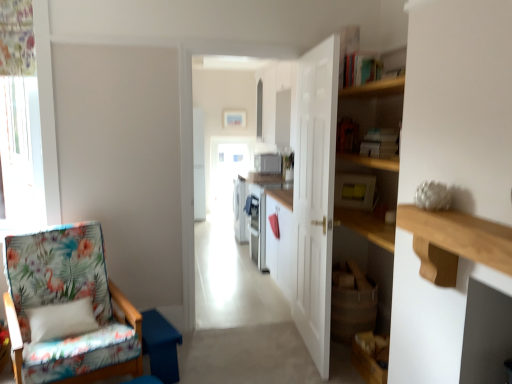
You are a GUI agent. You are given a task and a screenshot of the screen. Output one action in this format:
    pyautogui.click(x=<x>, y=<y>)
    Task: Click on the blank space above white glossy microwave at center (from a real-world perspective)
    Image resolution: width=512 pixels, height=384 pixels.
    Given the screenshot: What is the action you would take?
    click(248, 41)